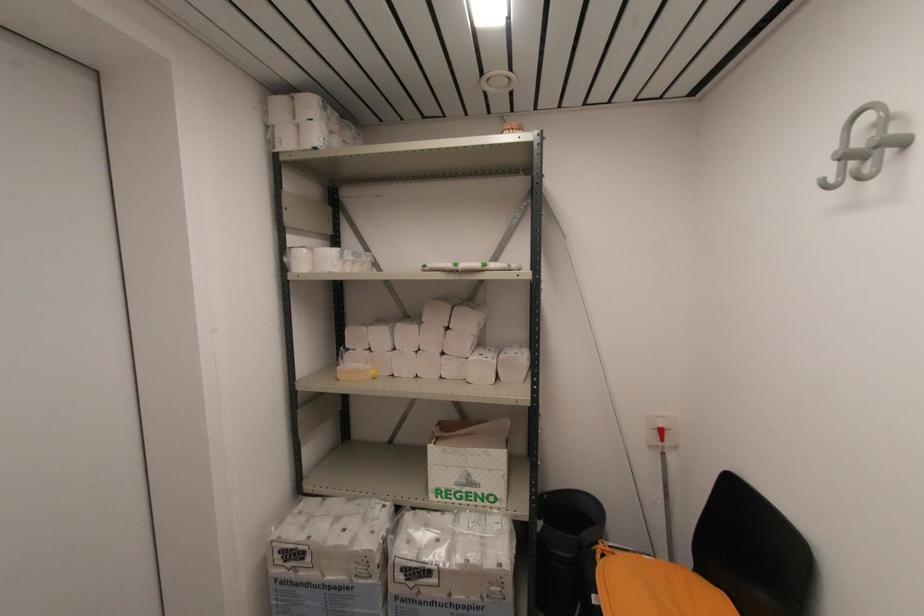
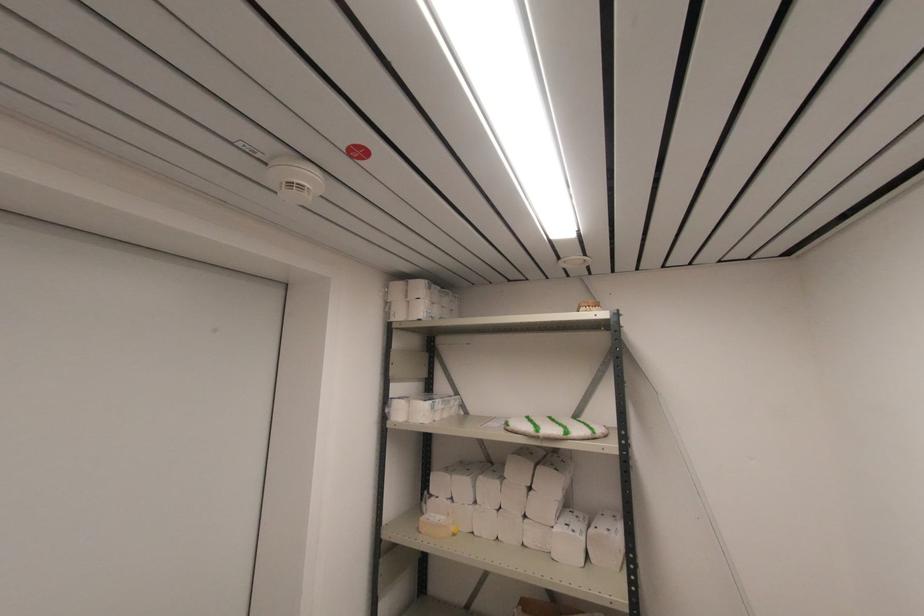
Locate, in the second image, the point that corresponds to point 514,130 in the first image.

(590, 307)